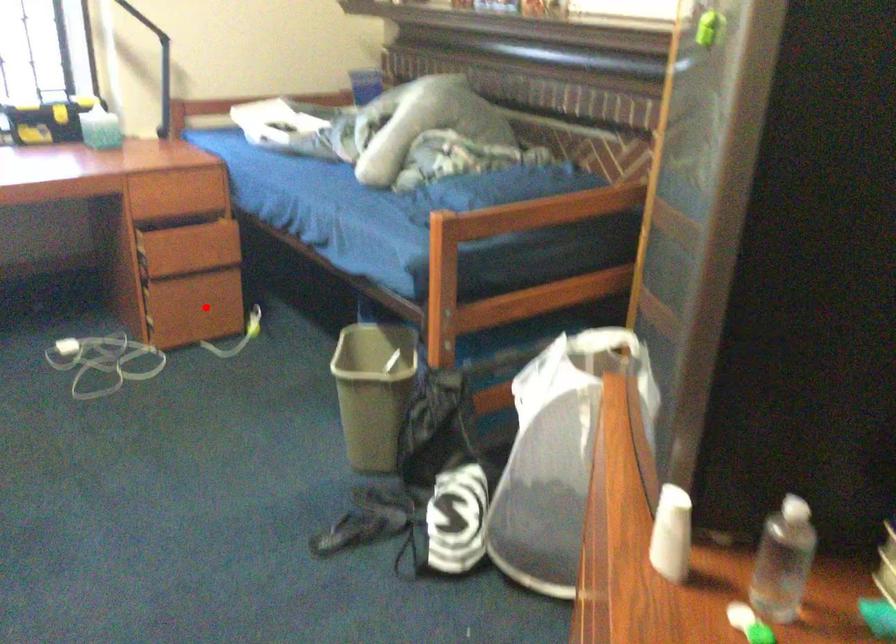
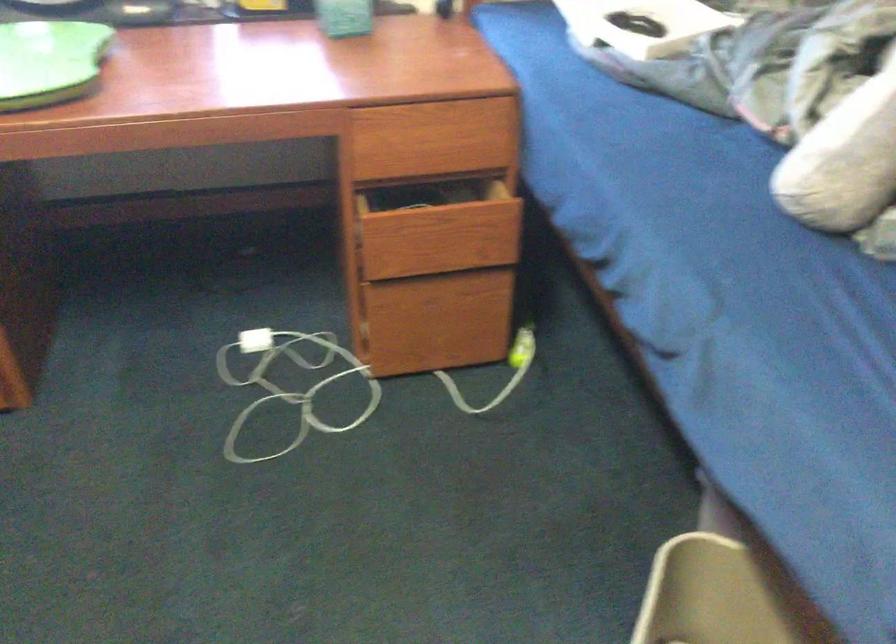
Question: I am providing you with two images of the same scene from different viewpoints. In image1, a red point is highlighted. Considering the same 3D point in image2, which of the following is correct?

Choices:
 (A) It is closer
 (B) It is farther

Answer: (A)